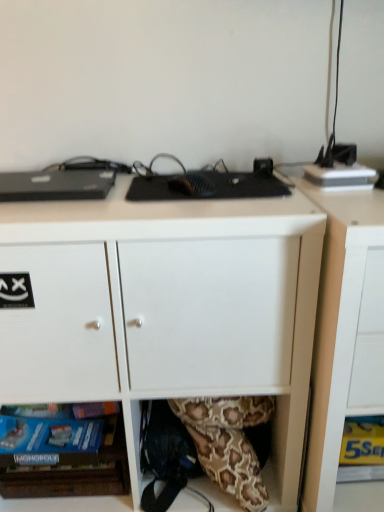
Question: Considering the relative sizes of yellow paper at lower right and matte white cabinet at lower right in the image provided, is yellow paper at lower right bigger than matte white cabinet at lower right?

Choices:
 (A) yes
 (B) no

Answer: (B)

Question: From the image's perspective, is yellow paper at lower right located above matte white cabinet at lower right?

Choices:
 (A) no
 (B) yes

Answer: (A)

Question: Is yellow paper at lower right not close to matte white cabinet at lower right?

Choices:
 (A) yes
 (B) no

Answer: (B)

Question: Is yellow paper at lower right positioned in front of matte white cabinet at lower right?

Choices:
 (A) yes
 (B) no

Answer: (B)

Question: Is yellow paper at lower right beside matte white cabinet at lower right?

Choices:
 (A) yes
 (B) no

Answer: (B)

Question: In terms of height, does white matte desk at center look taller or shorter compared to matte white cabinet at lower right?

Choices:
 (A) short
 (B) tall

Answer: (A)

Question: Choose the correct answer: Is white matte desk at center inside matte white cabinet at lower right or outside it?

Choices:
 (A) outside
 (B) inside

Answer: (A)

Question: Considering the positions of white matte desk at center and matte white cabinet at lower right in the image, is white matte desk at center bigger or smaller than matte white cabinet at lower right?

Choices:
 (A) big
 (B) small

Answer: (A)

Question: Looking at their shapes, would you say white matte desk at center is wider or thinner than matte white cabinet at lower right?

Choices:
 (A) thin
 (B) wide

Answer: (B)

Question: From the image's perspective, is white matte desk at center positioned above or below yellow paper at lower right?

Choices:
 (A) above
 (B) below

Answer: (A)

Question: From a real-world perspective, is white matte desk at center above or below yellow paper at lower right?

Choices:
 (A) below
 (B) above

Answer: (B)

Question: Looking at the image, does white matte desk at center seem bigger or smaller compared to yellow paper at lower right?

Choices:
 (A) small
 (B) big

Answer: (B)

Question: Do you think white matte desk at center is within yellow paper at lower right, or outside of it?

Choices:
 (A) outside
 (B) inside

Answer: (A)

Question: From their relative heights in the image, would you say yellow paper at lower right is taller or shorter than white matte desk at center?

Choices:
 (A) tall
 (B) short

Answer: (B)

Question: Do you think yellow paper at lower right is within white matte desk at center, or outside of it?

Choices:
 (A) outside
 (B) inside

Answer: (A)